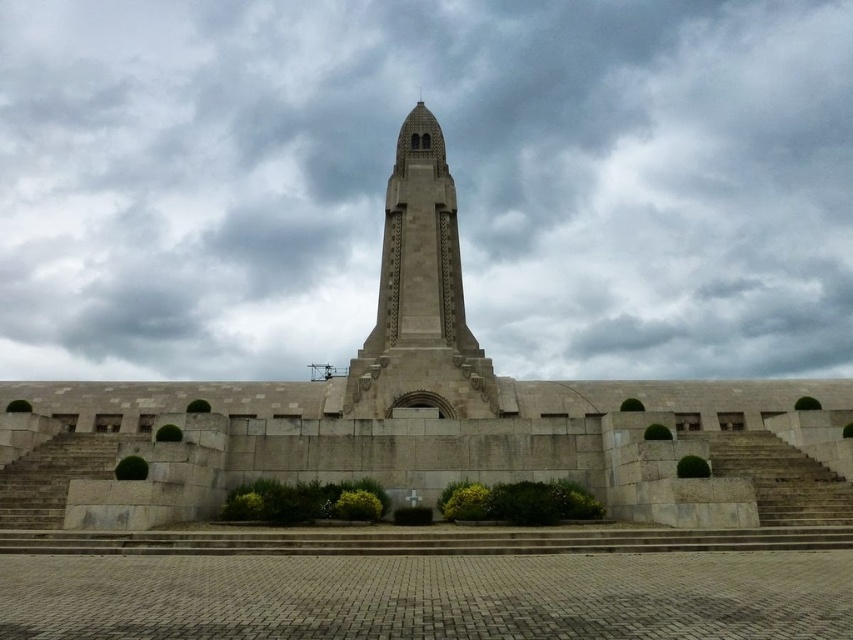
Question: Which of the following is the closest to the observer?

Choices:
 (A) (804, 474)
 (B) (408, 170)
 (C) (54, 448)

Answer: (A)

Question: Does gray stone stairs at center appear on the right side of gray stone stairs at lower left?

Choices:
 (A) yes
 (B) no

Answer: (A)

Question: Where is gray cloudy sky at center located in relation to beige stone bell tower at center in the image?

Choices:
 (A) below
 (B) above

Answer: (B)

Question: Which point is farther to the camera?

Choices:
 (A) (450, 369)
 (B) (482, 244)

Answer: (B)

Question: Which is nearer to the gray cloudy sky at center?

Choices:
 (A) gray stone stairs at center
 (B) beige stone bell tower at center

Answer: (B)

Question: Does gray cloudy sky at center have a greater width compared to gray stone stairs at lower left?

Choices:
 (A) yes
 (B) no

Answer: (A)